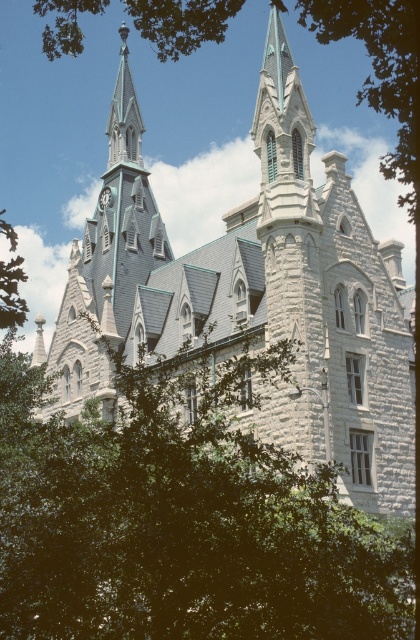
Question: Which of the following is the farthest from the observer?

Choices:
 (A) (139, 284)
 (B) (193, 8)

Answer: (A)

Question: Is green leafy tree at lower left to the right of gray stone clock tower at center from the viewer's perspective?

Choices:
 (A) no
 (B) yes

Answer: (B)

Question: Which point is farther from the camera taking this photo?

Choices:
 (A) (113, 289)
 (B) (113, 563)

Answer: (A)

Question: Does green leafy tree at lower left appear under green leafy tree at upper left?

Choices:
 (A) no
 (B) yes

Answer: (B)

Question: Among these objects, which one is nearest to the camera?

Choices:
 (A) green leafy tree at upper left
 (B) gray stone clock tower at center

Answer: (A)

Question: Can you confirm if green leafy tree at lower left is positioned to the right of green leafy tree at upper left?

Choices:
 (A) yes
 (B) no

Answer: (B)